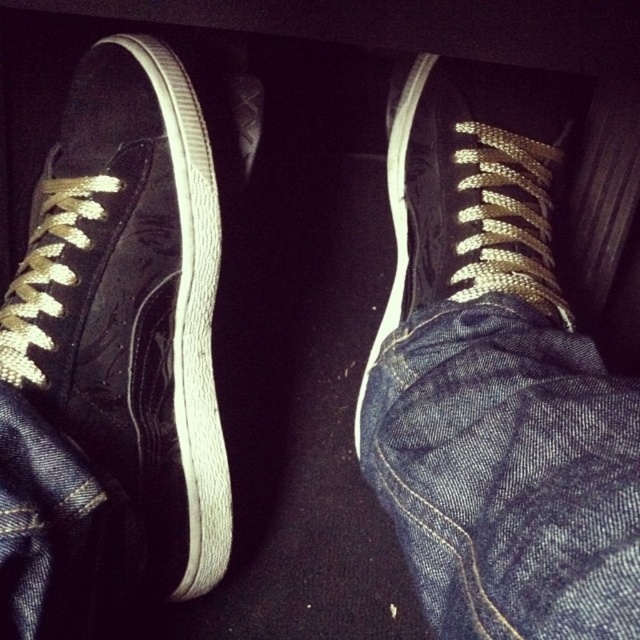
Question: Among these points, which one is farthest from the camera?

Choices:
 (A) (141, 227)
 (B) (474, 266)
 (C) (412, 376)

Answer: (B)

Question: Does denim at center appear under matte black sneaker at center?

Choices:
 (A) yes
 (B) no

Answer: (A)

Question: Can you confirm if suede/black shoe at left is thinner than denim at center?

Choices:
 (A) no
 (B) yes

Answer: (A)

Question: Based on their relative distances, which object is farther from the matte black sneaker at center?

Choices:
 (A) denim at center
 (B) suede/black shoe at left

Answer: (B)

Question: Can you confirm if suede/black shoe at left is positioned to the left of denim at center?

Choices:
 (A) no
 (B) yes

Answer: (B)

Question: Among these points, which one is farthest from the camera?

Choices:
 (A) (145, 330)
 (B) (589, 634)
 (C) (454, 92)

Answer: (C)